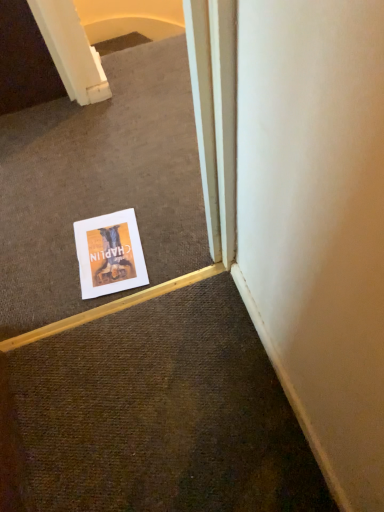
Image resolution: width=384 pixels, height=512 pixels. What do you see at coordinates (109, 254) in the screenshot? I see `white paper poster at center` at bounding box center [109, 254].

Locate an element on the screen. The image size is (384, 512). white paper poster at center is located at coordinates (109, 254).

Identify the location of white paper at center. This screenshot has width=384, height=512. (100, 189).

The image size is (384, 512). What do you see at coordinates (100, 189) in the screenshot?
I see `white paper at center` at bounding box center [100, 189].

In order to face white paper at center, should I rotate leftwards or rightwards?

A 11.164 degree turn to the left will do.

You are a GUI agent. You are given a task and a screenshot of the screen. Output one action in this format:
    pyautogui.click(x=<x>, y=<y>)
    Task: Click on the white paper poster at center
    This screenshot has height=512, width=384.
    Given the screenshot: What is the action you would take?
    pyautogui.click(x=109, y=254)

Based on the photo, is white paper at center to the left of white paper poster at center from the viewer's perspective?

Indeed, white paper at center is positioned on the left side of white paper poster at center.

Does white paper at center lie in front of white paper poster at center?

Yes, white paper at center is closer to the viewer.

Between point (156, 53) and point (130, 223), which one is positioned in front?

Point (130, 223)

From the image's perspective, is white paper at center located above or below white paper poster at center?

Based on their image positions, white paper at center is located above white paper poster at center.

From a real-world perspective, who is located lower, white paper at center or white paper poster at center?

white paper poster at center.

Can you confirm if white paper at center is wider than white paper poster at center?

Indeed, white paper at center has a greater width compared to white paper poster at center.

Does white paper at center have a greater height compared to white paper poster at center?

Correct, white paper at center is much taller as white paper poster at center.

Who is bigger, white paper at center or white paper poster at center?

With larger size is white paper at center.

Is white paper at center outside of white paper poster at center?

white paper at center is positioned outside white paper poster at center.

Is white paper at center positioned far away from white paper poster at center?

Actually, white paper at center and white paper poster at center are a little close together.

Could you tell me if white paper at center is facing white paper poster at center?

Yes, white paper at center is aimed at white paper poster at center.

Where is `poster below the white paper at center (from the image's perspective)`? Image resolution: width=384 pixels, height=512 pixels. poster below the white paper at center (from the image's perspective) is located at coordinates (109, 254).

Based on their positions, is white paper poster at center located to the left or right of white paper at center?

white paper poster at center is to the right of white paper at center.

Relative to white paper at center, is white paper poster at center in front or behind?

Visually, white paper poster at center is located behind white paper at center.

Is point (133, 272) in front of point (1, 253)?

Yes, it is in front of point (1, 253).

From the image's perspective, is white paper poster at center located above or below white paper at center?

Clearly, from the image's perspective, white paper poster at center is below white paper at center.

From a real-world perspective, is white paper poster at center physically located above or below white paper at center?

Clearly, from a real-world perspective, white paper poster at center is below white paper at center.

Considering the relative sizes of white paper poster at center and white paper at center in the image provided, is white paper poster at center thinner than white paper at center?

Indeed, white paper poster at center has a lesser width compared to white paper at center.

Considering the sizes of white paper poster at center and white paper at center in the image, is white paper poster at center taller or shorter than white paper at center?

Clearly, white paper poster at center is shorter compared to white paper at center.

Considering the sizes of white paper poster at center and white paper at center in the image, is white paper poster at center bigger or smaller than white paper at center?

white paper poster at center is smaller than white paper at center.

Could white paper at center be considered to be inside white paper poster at center?

Definitely not — white paper at center is not inside white paper poster at center.

Is white paper poster at center directly adjacent to white paper at center?

No, white paper poster at center is not with white paper at center.

Is white paper poster at center turned away from white paper at center?

Yes, white paper poster at center is facing away from white paper at center.

Where is `poster behind the white paper at center`? poster behind the white paper at center is located at coordinates (109, 254).

Where is `escalator that appears on the left of white paper poster at center`? escalator that appears on the left of white paper poster at center is located at coordinates (100, 189).

The width and height of the screenshot is (384, 512). Identify the location of escalator in front of the white paper poster at center. (100, 189).